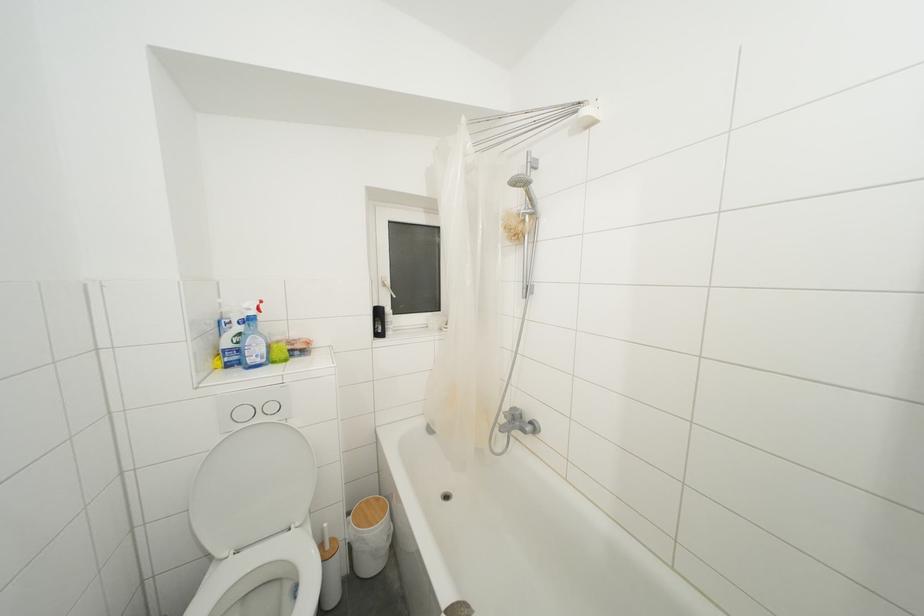
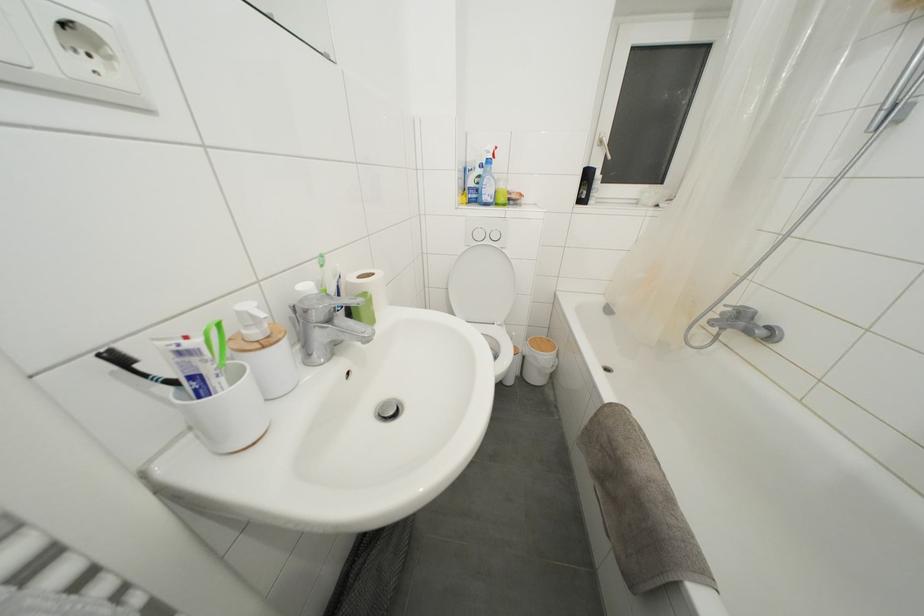
In the second image, find the point that corresponds to (383,318) in the first image.

(591, 180)